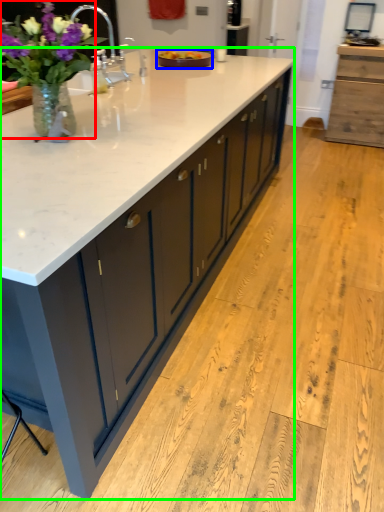
Question: Which is nearer to the houseplant (highlighted by a red box)? tray (highlighted by a blue box) or countertop (highlighted by a green box).

Choices:
 (A) tray
 (B) countertop

Answer: (B)